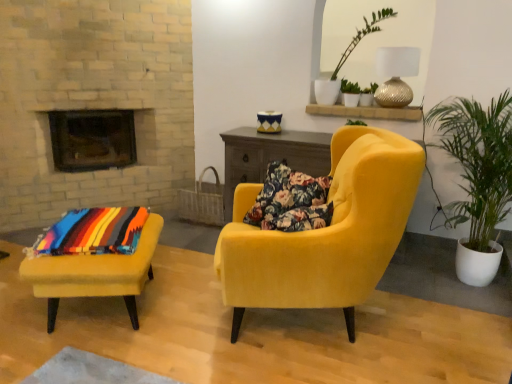
Question: Is green leafy plant in white pot at right spatially inside green leafy plant at upper center, or outside of it?

Choices:
 (A) inside
 (B) outside

Answer: (B)

Question: From a real-world perspective, is green leafy plant in white pot at right positioned above or below green leafy plant at upper center?

Choices:
 (A) below
 (B) above

Answer: (A)

Question: Based on their relative distances, which object is farther from the green leafy plant at upper center?

Choices:
 (A) black glass fireplace at upper left
 (B) gold textured lamp at upper right
 (C) multicolored woven blanket at lower left
 (D) floral fabric pillow at center
 (E) green leafy plant in white pot at right

Answer: (C)

Question: Which object is positioned closest to the black glass fireplace at upper left?

Choices:
 (A) gold textured lamp at upper right
 (B) velvet yellow armchair at center, which ranks as the first chair in right-to-left order
 (C) green leafy plant at upper center
 (D) green leafy plant in white pot at right
 (E) velvet yellow ottoman at lower left, which is the 2th chair in right-to-left order

Answer: (E)